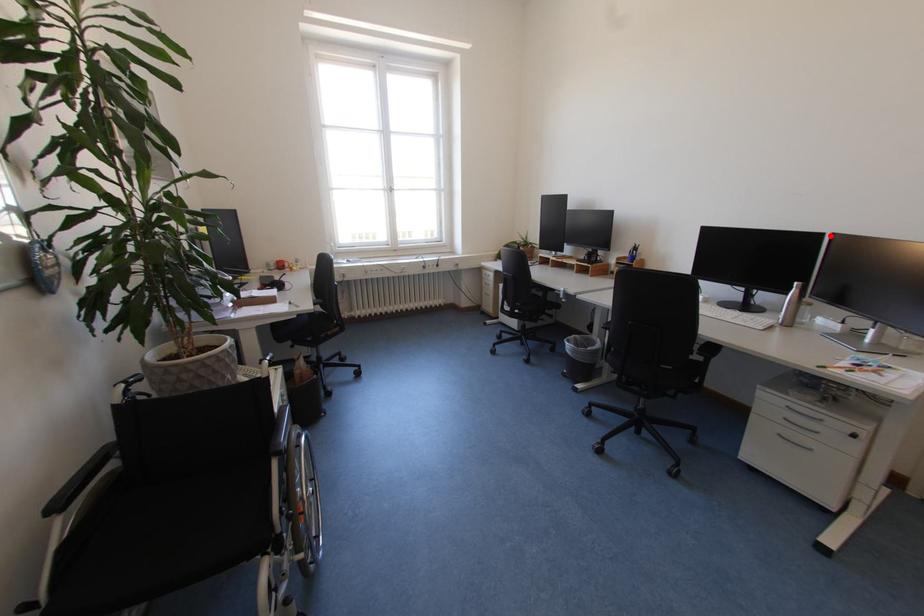
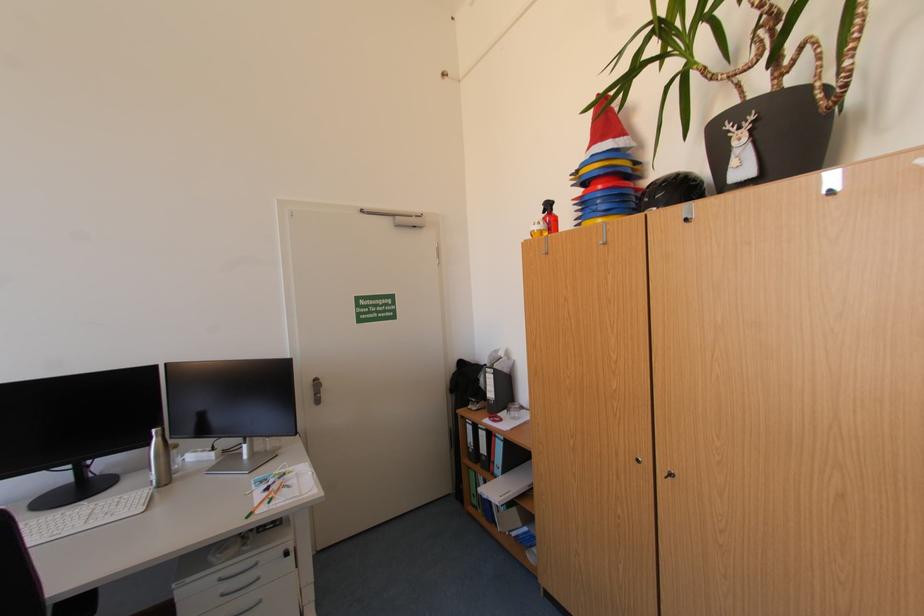
The point at the highlighted location is marked in the first image. Where is the corresponding point in the second image?

(164, 368)